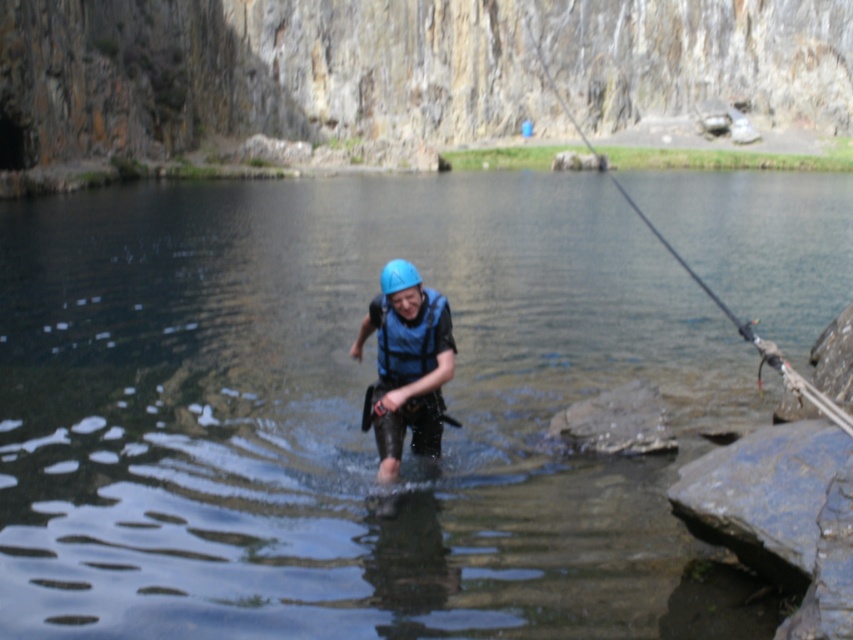
Does clear water at center appear under blue matte helmet at center?

Actually, clear water at center is above blue matte helmet at center.

Does clear water at center have a greater height compared to blue matte helmet at center?

Indeed, clear water at center has a greater height compared to blue matte helmet at center.

What do you see at coordinates (347, 416) in the screenshot? I see `clear water at center` at bounding box center [347, 416].

You are a GUI agent. You are given a task and a screenshot of the screen. Output one action in this format:
    pyautogui.click(x=<x>, y=<y>)
    Task: Click on the clear water at center
    The image size is (853, 640).
    Given the screenshot: What is the action you would take?
    pyautogui.click(x=347, y=416)

Who is taller, clear water at center or blue matte life vest at center?

clear water at center is taller.

Between point (738, 429) and point (433, 365), which one is positioned in front?

Positioned in front is point (433, 365).

Locate an element on the screen. clear water at center is located at coordinates (347, 416).

Is blue matte safety vest at center bigger than blue matte helmet at center?

No, blue matte safety vest at center is not bigger than blue matte helmet at center.

How far apart are blue matte safety vest at center and blue matte helmet at center?

blue matte safety vest at center and blue matte helmet at center are 4.85 feet apart.

Locate an element on the screen. Image resolution: width=853 pixels, height=640 pixels. blue matte safety vest at center is located at coordinates point(408,339).